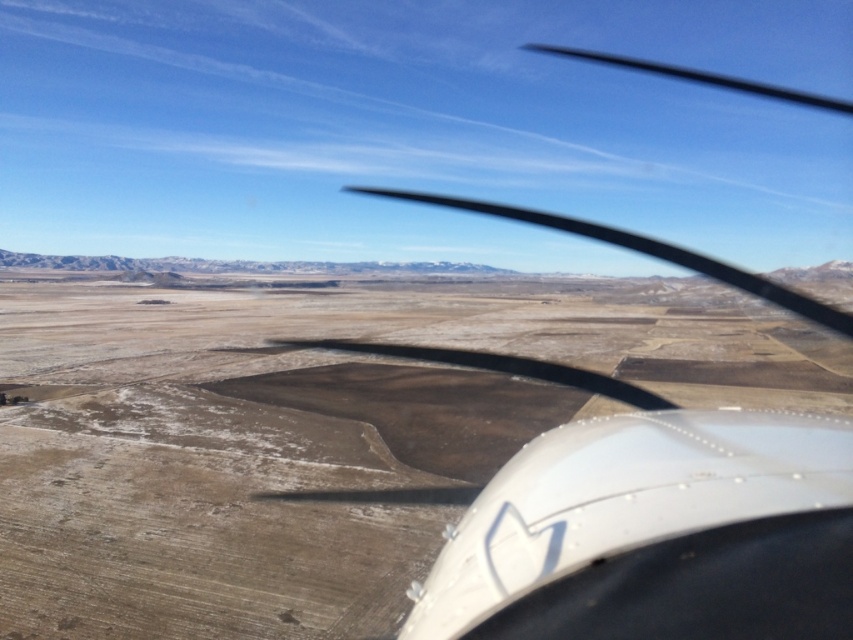
Question: Is brown/dry soil at center further to camera compared to white matte wing at upper right?

Choices:
 (A) yes
 (B) no

Answer: (A)

Question: Which point is closer to the camera?

Choices:
 (A) brown/dry soil at center
 (B) white matte wing at upper right

Answer: (B)

Question: Does brown/dry soil at center appear on the right side of white matte wing at upper right?

Choices:
 (A) no
 (B) yes

Answer: (A)

Question: Which of the following is the farthest from the observer?

Choices:
 (A) white matte wing at upper right
 (B) brown/dry soil at center

Answer: (B)

Question: Is brown/dry soil at center below white matte wing at upper right?

Choices:
 (A) yes
 (B) no

Answer: (A)

Question: Which of the following is the closest to the observer?

Choices:
 (A) brown/dry soil at center
 (B) white matte wing at upper right

Answer: (B)